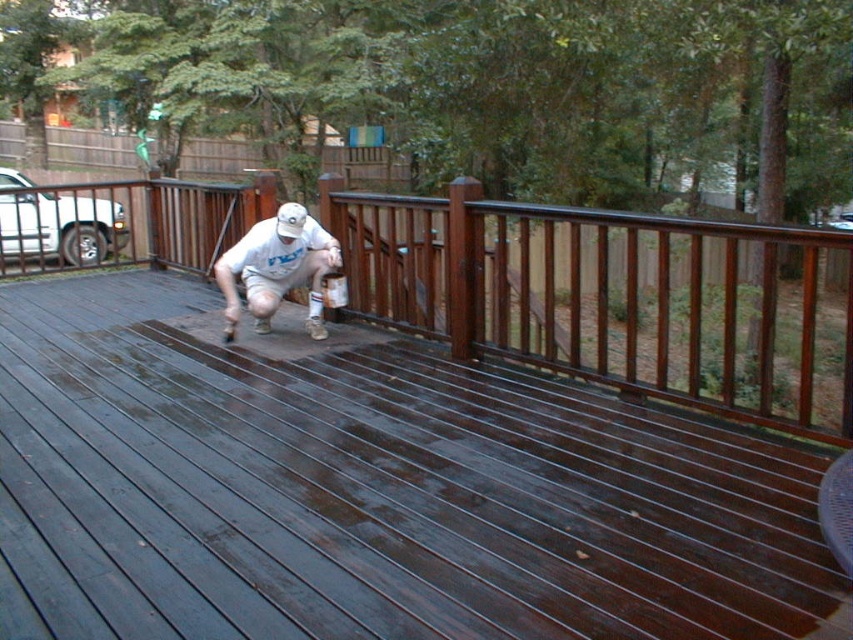
You are a contractor inspecting a deck. You notice two sections of wood at the center of the deck. One is labeled as dark stained wood deck at center and the other as dark brown wood at center. Which section is located to the left of the other?

The dark stained wood deck at center is positioned on the left side of dark brown wood at center.

You are standing in front of the deck and want to apply stain to the dark brown wood at center. If your spray can has a maximum range of 3 meters, will you be able to reach it without moving closer?

The dark brown wood at center is 3.12 meters away from the camera, which exceeds the spray can maximum range of 3 meters. Therefore, you need to move closer to reach it.